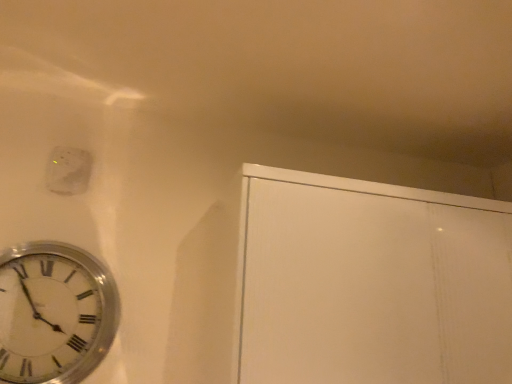
Identify the location of silver metallic clock at lower left. Image resolution: width=512 pixels, height=384 pixels. (54, 313).

Find the location of `white matte cabinet at upper right`. white matte cabinet at upper right is located at coordinates [371, 282].

Describe the element at coordinates (371, 282) in the screenshot. I see `white matte cabinet at upper right` at that location.

Where is `white matte electric outlet at upper left`? The width and height of the screenshot is (512, 384). white matte electric outlet at upper left is located at coordinates (68, 170).

The width and height of the screenshot is (512, 384). Identify the location of wall clock that is under the white matte cabinet at upper right (from a real-world perspective). (54, 313).

Which is behind, white matte cabinet at upper right or silver metallic clock at lower left?

silver metallic clock at lower left is behind.

Is white matte cabinet at upper right thinner than silver metallic clock at lower left?

In fact, white matte cabinet at upper right might be wider than silver metallic clock at lower left.

Is white matte cabinet at upper right bigger or smaller than silver metallic clock at lower left?

Clearly, white matte cabinet at upper right is larger in size than silver metallic clock at lower left.

Is white matte electric outlet at upper left bigger or smaller than silver metallic clock at lower left?

Considering their sizes, white matte electric outlet at upper left takes up less space than silver metallic clock at lower left.

What are the coordinates of `electric outlet above the silver metallic clock at lower left (from the image's perspective)` in the screenshot? It's located at (68, 170).

Is white matte electric outlet at upper left facing away from silver metallic clock at lower left?

No, silver metallic clock at lower left is not at the back of white matte electric outlet at upper left.

In the image, is white matte electric outlet at upper left on the left side or the right side of silver metallic clock at lower left?

Based on their positions, white matte electric outlet at upper left is located to the left of silver metallic clock at lower left.

Would you say white matte cabinet at upper right is a long distance from white matte electric outlet at upper left?

white matte cabinet at upper right is actually quite close to white matte electric outlet at upper left.

Which is correct: white matte cabinet at upper right is inside white matte electric outlet at upper left, or outside of it?

white matte cabinet at upper right lies outside white matte electric outlet at upper left.

Is white matte cabinet at upper right in front of or behind white matte electric outlet at upper left in the image?

Visually, white matte cabinet at upper right is located in front of white matte electric outlet at upper left.

Is white matte cabinet at upper right to the left or to the right of white matte electric outlet at upper left in the image?

white matte cabinet at upper right is to the right of white matte electric outlet at upper left.

From a real-world perspective, who is located higher, white matte electric outlet at upper left or white matte cabinet at upper right?

In real-world perspective, white matte electric outlet at upper left is above.

In terms of height, does white matte electric outlet at upper left look taller or shorter compared to white matte cabinet at upper right?

In the image, white matte electric outlet at upper left appears to be shorter than white matte cabinet at upper right.

How many degrees apart are the facing directions of white matte electric outlet at upper left and white matte cabinet at upper right?

0.218 degrees.

Is silver metallic clock at lower left not close to white matte electric outlet at upper left?

That's not correct — silver metallic clock at lower left is a little close to white matte electric outlet at upper left.

From the image's perspective, between silver metallic clock at lower left and white matte electric outlet at upper left, who is located below?

silver metallic clock at lower left appears lower in the image.

From a real-world perspective, is silver metallic clock at lower left located higher than white matte electric outlet at upper left?

No.

In the image, there is a silver metallic clock at lower left. At what (x,y) coordinates should I click in order to perform the action: click on glass door above it (from the image's perspective). Please return your answer as a coordinate pair (x, y). The height and width of the screenshot is (384, 512). Looking at the image, I should click on (371, 282).

From a real-world perspective, does silver metallic clock at lower left sit lower than white matte cabinet at upper right?

Yes, from a real-world perspective, silver metallic clock at lower left is under white matte cabinet at upper right.

From the image's perspective, is silver metallic clock at lower left positioned above or below white matte cabinet at upper right?

Based on their image positions, silver metallic clock at lower left is located beneath white matte cabinet at upper right.

Image resolution: width=512 pixels, height=384 pixels. Find the location of `glass door that is on the right side of silver metallic clock at lower left`. glass door that is on the right side of silver metallic clock at lower left is located at coordinates (371, 282).

I want to click on electric outlet above the silver metallic clock at lower left (from the image's perspective), so click(68, 170).

Looking at the image, which one is located closer to white matte cabinet at upper right, white matte electric outlet at upper left or silver metallic clock at lower left?

Based on the image, silver metallic clock at lower left appears to be nearer to white matte cabinet at upper right.

Based on their spatial positions, is silver metallic clock at lower left or white matte cabinet at upper right further from white matte electric outlet at upper left?

white matte cabinet at upper right is further to white matte electric outlet at upper left.

Which object lies nearer to the anchor point white matte cabinet at upper right, silver metallic clock at lower left or white matte electric outlet at upper left?

Among the two, silver metallic clock at lower left is located nearer to white matte cabinet at upper right.

Based on their spatial positions, is white matte cabinet at upper right or silver metallic clock at lower left closer to white matte electric outlet at upper left?

silver metallic clock at lower left.

Estimate the real-world distances between objects in this image. Which object is closer to silver metallic clock at lower left, white matte electric outlet at upper left or white matte cabinet at upper right?

white matte electric outlet at upper left lies closer to silver metallic clock at lower left than the other object.

Consider the image. Which object lies nearer to the anchor point silver metallic clock at lower left, white matte cabinet at upper right or white matte electric outlet at upper left?

white matte electric outlet at upper left is closer to silver metallic clock at lower left.

Where is `wall clock between white matte electric outlet at upper left and white matte cabinet at upper right from left to right`? wall clock between white matte electric outlet at upper left and white matte cabinet at upper right from left to right is located at coordinates (54, 313).